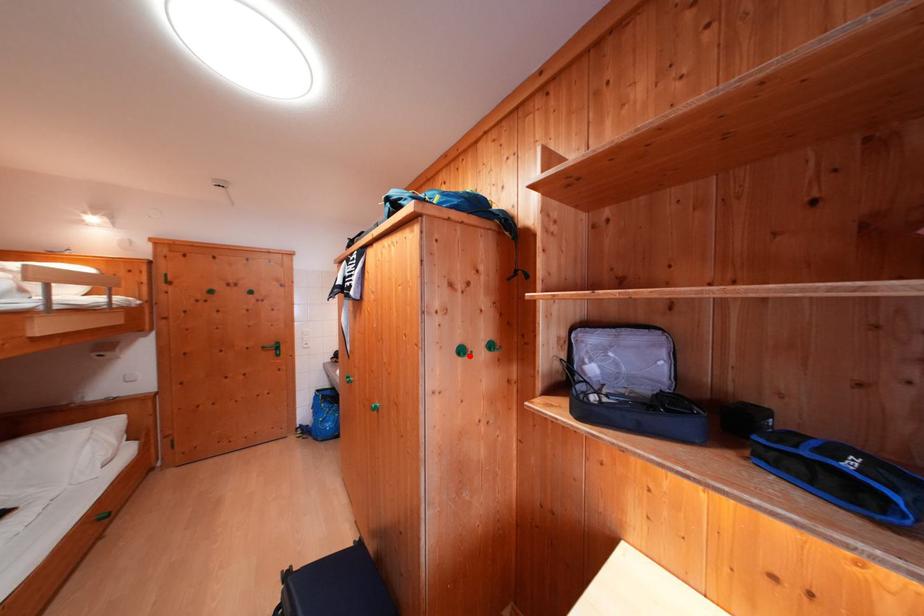
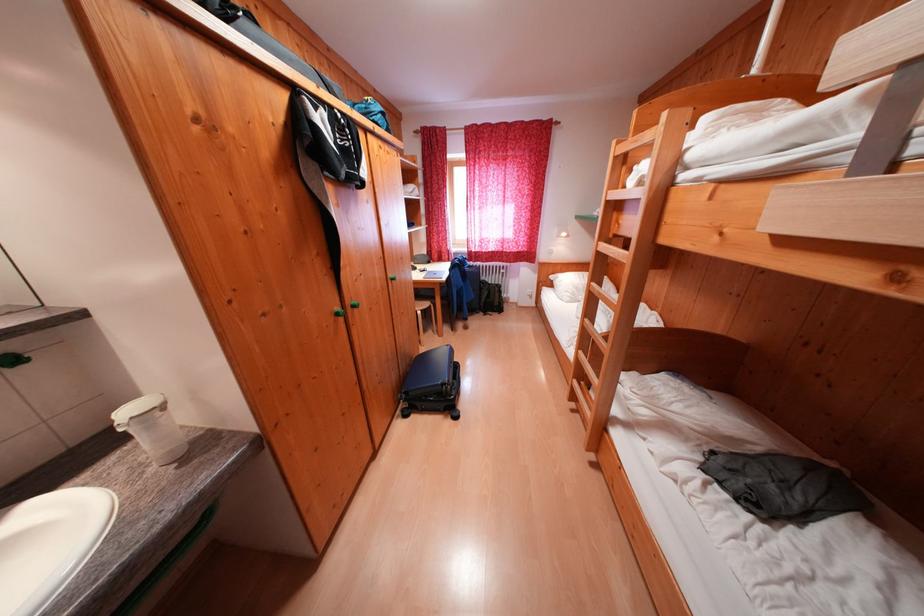
Question: I am providing you with two images of the same scene from different viewpoints. A red point is marked on the first image. Is the red point's position out of view in image 2?

Choices:
 (A) Yes
 (B) No

Answer: (A)